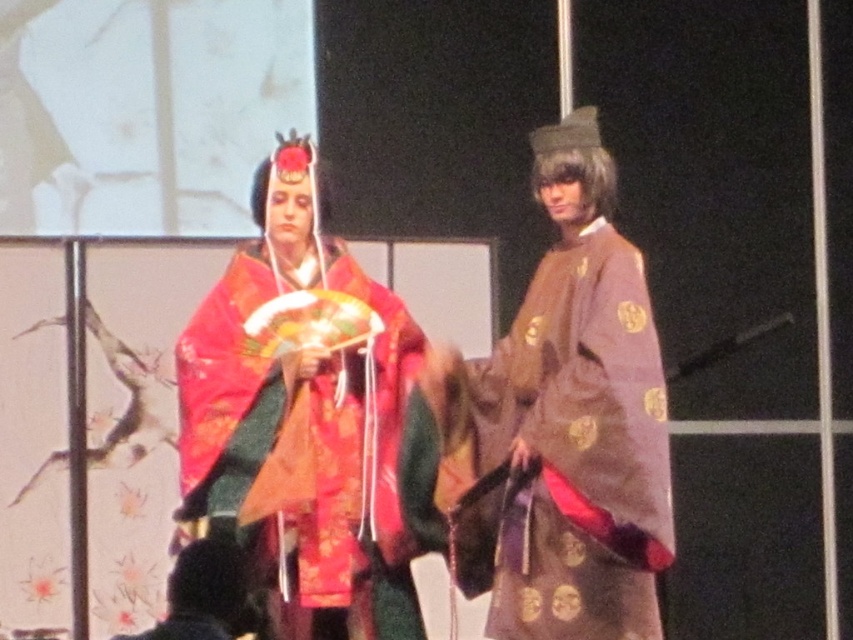
Between matte red kimono at center and matte brown robe at center, which one has more height?

With more height is matte brown robe at center.

Does point (287, 552) come in front of point (602, 448)?

No, it is behind (602, 448).

Describe the element at coordinates (428, 422) in the screenshot. I see `matte red kimono at center` at that location.

At what (x,y) coordinates should I click in order to perform the action: click on matte red kimono at center. Please return your answer as a coordinate pair (x, y). Looking at the image, I should click on (428, 422).

Does matte brown robe at center appear over silky red kimono at center?

Correct, matte brown robe at center is located above silky red kimono at center.

From the picture: Which is below, matte brown robe at center or silky red kimono at center?

silky red kimono at center

The image size is (853, 640). Describe the element at coordinates (564, 424) in the screenshot. I see `matte brown robe at center` at that location.

The height and width of the screenshot is (640, 853). Find the location of `matte brown robe at center`. matte brown robe at center is located at coordinates (564, 424).

Between matte red kimono at center and silky red kimono at center, which one is positioned lower?

Positioned lower is matte red kimono at center.

Does matte red kimono at center appear on the right side of silky red kimono at center?

Correct, you'll find matte red kimono at center to the right of silky red kimono at center.

Is point (634, 374) positioned behind point (271, 385)?

No, it is in front of (271, 385).

What are the coordinates of `matte red kimono at center` in the screenshot? It's located at pyautogui.click(x=428, y=422).